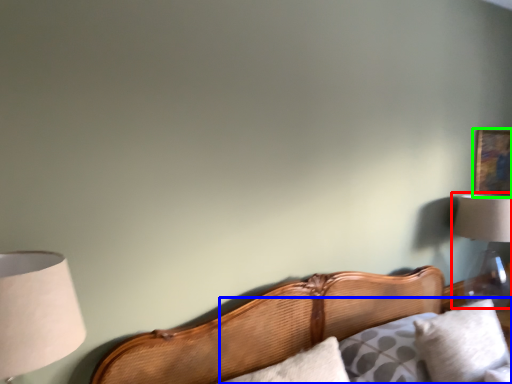
Question: Estimate the real-world distances between objects in this image. Which object is farther from lamp (highlighted by a red box), couch (highlighted by a blue box) or picture frame (highlighted by a green box)?

Choices:
 (A) couch
 (B) picture frame

Answer: (A)